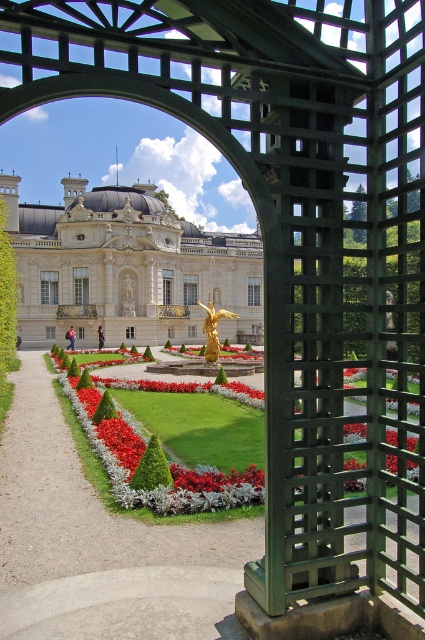
You are a visitor standing at the entrance of the garden. You see the gravel pathway at center and the white glossy palace at center. Which one is lower in height?

The gravel pathway at center has a lesser height compared to the white glossy palace at center, so the gravel pathway at center is lower.

You are standing in the garden and want to take a photo of the white glossy palace at center through the green trellis archway on the right. Based on the palace location, will the palace be centered in the photo if you frame it using the archway?

The white glossy palace at center is located at coordinates approximately 0.417 along the x axis and 0.299 along the y axis. Since the center of the image would be at coordinates around 0.5 in both axes, the palace is slightly to the left and lower than the exact center. Therefore, if you frame it using the archway on the right, the palace might not be perfectly centered in the photo.

You are a landscape architect designing a new garden layout. You have to place a decorative fountain in the garden. Given the gravel pathway at center and the gold polished statue at center, which object should the fountain be placed closer to if you want to ensure it doesn

The gravel pathway at center occupies less space than the gold polished statue at center, so placing the fountain closer to the gold polished statue at center would allow for more space around the statue and better balance in the garden layout.